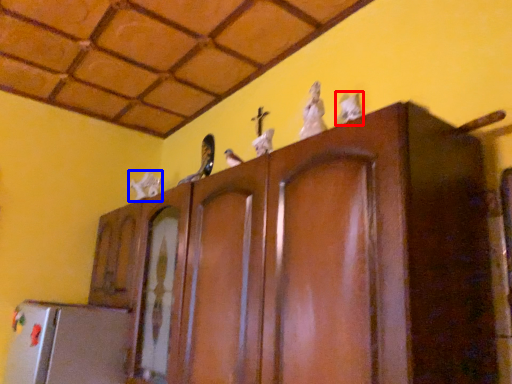
Question: Among these objects, which one is nearest to the camera, animal (highlighted by a red box) or animal (highlighted by a blue box)?

Choices:
 (A) animal
 (B) animal

Answer: (A)